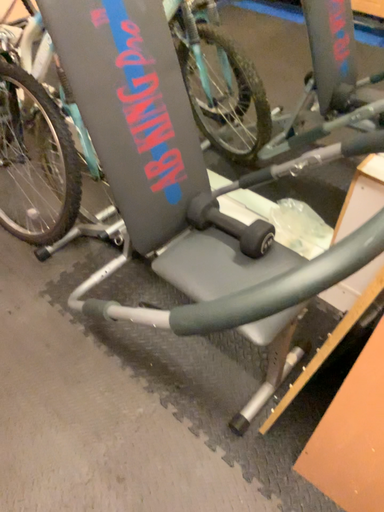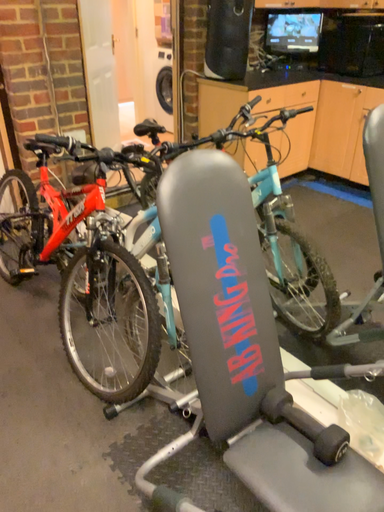
Question: How did the camera likely rotate when shooting the video?

Choices:
 (A) rotated upward
 (B) rotated downward

Answer: (A)